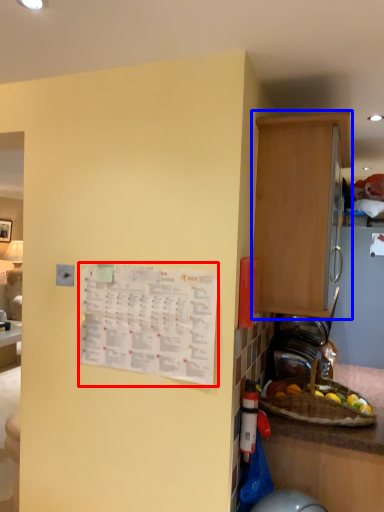
Question: Which object is further to the camera taking this photo, poster (highlighted by a red box) or cabinetry (highlighted by a blue box)?

Choices:
 (A) poster
 (B) cabinetry

Answer: (B)